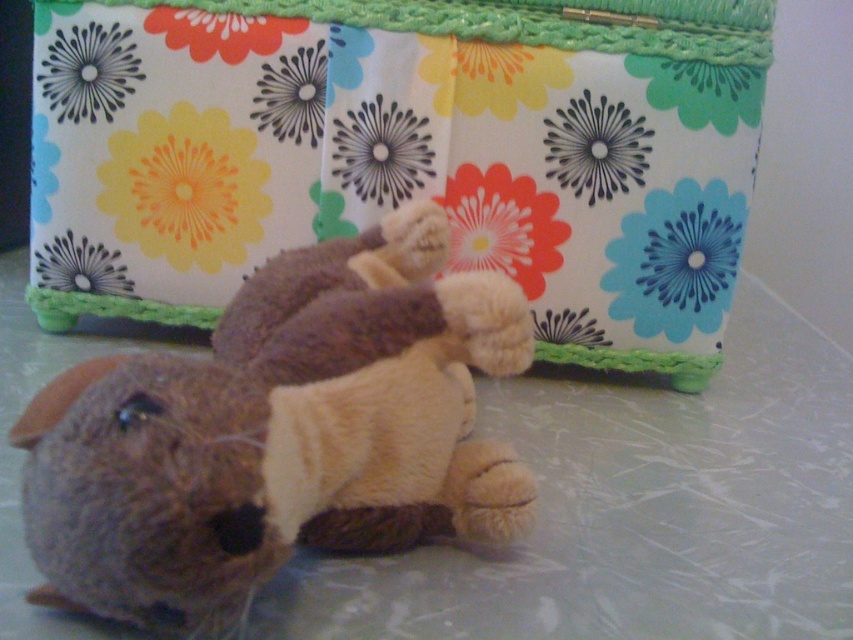
Question: Which point is farther to the camera?

Choices:
 (A) (488, 330)
 (B) (367, 205)

Answer: (B)

Question: Is floral fabric box at upper center behind fuzzy brown stuffed animal at lower left?

Choices:
 (A) yes
 (B) no

Answer: (A)

Question: From the image, what is the correct spatial relationship of floral fabric box at upper center in relation to fuzzy brown stuffed animal at lower left?

Choices:
 (A) left
 (B) right

Answer: (B)

Question: Is floral fabric box at upper center positioned before fuzzy brown stuffed animal at lower left?

Choices:
 (A) no
 (B) yes

Answer: (A)

Question: Which of the following is the closest to the observer?

Choices:
 (A) (117, 388)
 (B) (721, 296)

Answer: (A)